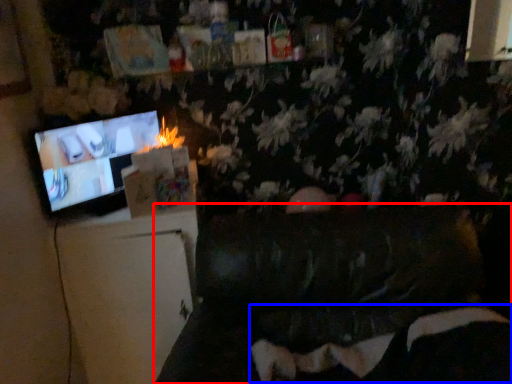
Question: Which object is further to the camera taking this photo, furniture (highlighted by a red box) or bean bag chair (highlighted by a blue box)?

Choices:
 (A) furniture
 (B) bean bag chair

Answer: (B)